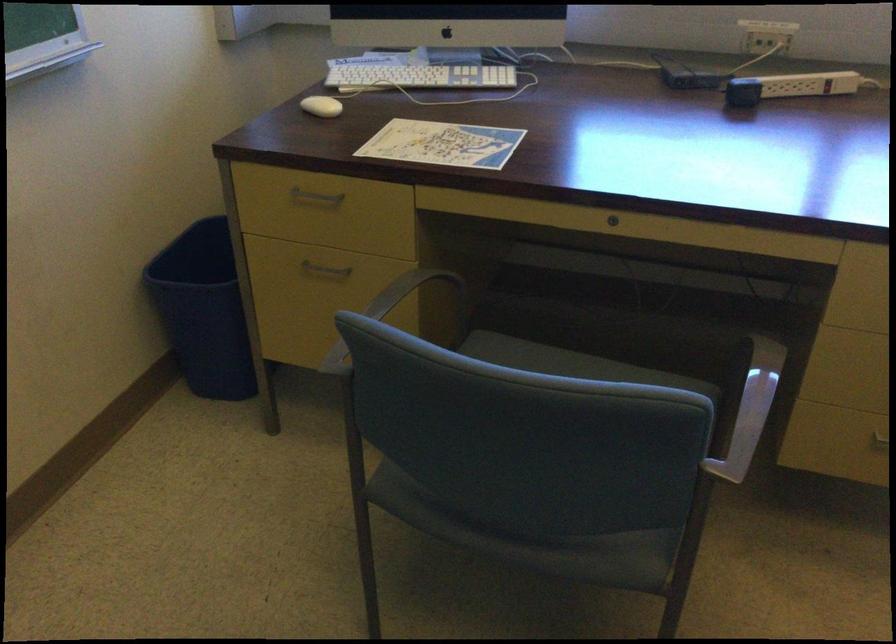
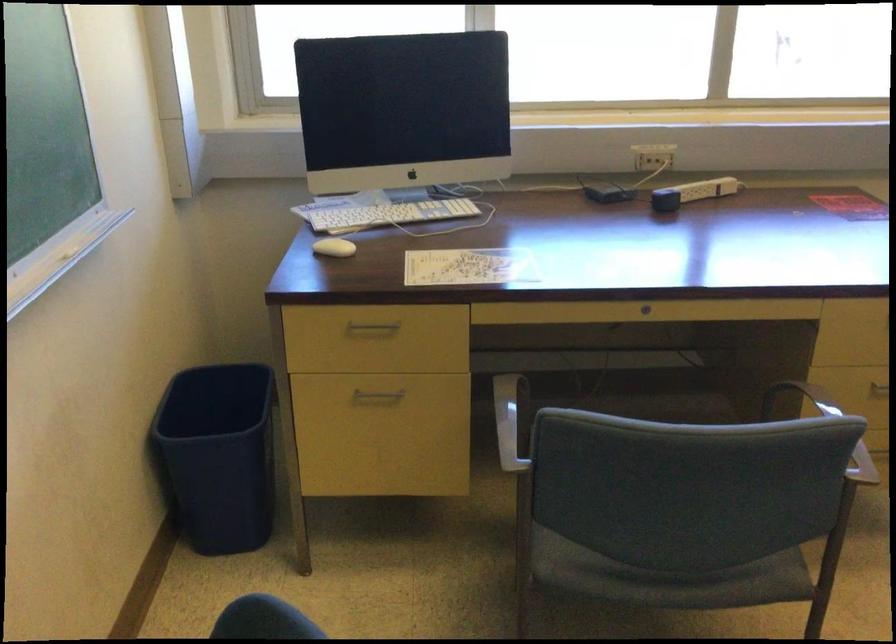
Find the pixel in the second image that matches the point at 503,532 in the first image.

(668, 578)